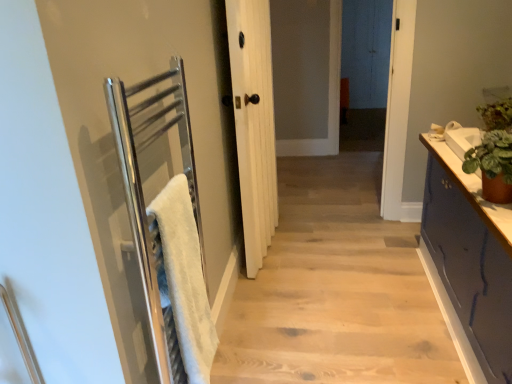
Identify the location of green matte plant pot at right. (473, 192).

What do you see at coordinates (254, 123) in the screenshot? The image size is (512, 384). I see `white wood door at center` at bounding box center [254, 123].

At what (x,y) coordinates should I click in order to perform the action: click on brushed metal towel rail at left. Please return your answer as a coordinate pair (x, y). Looking at the image, I should click on (336, 289).

What's the angular difference between white fluffy bath towel at left and dark blue painted cabinet at right's facing directions?

The angular difference between white fluffy bath towel at left and dark blue painted cabinet at right is 180 degrees.

Between white fluffy bath towel at left and dark blue painted cabinet at right, which one appears on the left side from the viewer's perspective?

From the viewer's perspective, white fluffy bath towel at left appears more on the left side.

Is point (176, 195) closer or farther from the camera than point (433, 250)?

Point (176, 195) is closer to the camera than point (433, 250).

From a real-world perspective, which is physically above, white fluffy bath towel at left or dark blue painted cabinet at right?

white fluffy bath towel at left is physically above.

Does dark blue painted cabinet at right turn towards green leafy plant at right?

No, dark blue painted cabinet at right is not aimed at green leafy plant at right.

Who is smaller, dark blue painted cabinet at right or green leafy plant at right?

green leafy plant at right is smaller.

Considering the sizes of dark blue painted cabinet at right and green leafy plant at right in the image, is dark blue painted cabinet at right wider or thinner than green leafy plant at right?

In the image, dark blue painted cabinet at right appears to be wider than green leafy plant at right.

Consider the image. From the image's perspective, which object appears higher, dark blue painted cabinet at right or green leafy plant at right?

From the image's view, green leafy plant at right is above.

Which is closer, (459, 187) or (242, 182)?

Point (459, 187).

Between green matte plant pot at right and white wood door at center, which one has less height?

green matte plant pot at right is shorter.

Is green matte plant pot at right positioned far away from white wood door at center?

Actually, green matte plant pot at right and white wood door at center are a little close together.

How much distance is there between green leafy plant at right and white fluffy bath towel at left?

green leafy plant at right and white fluffy bath towel at left are 5.29 feet apart from each other.

Is green leafy plant at right not inside white fluffy bath towel at left?

green leafy plant at right is positioned outside white fluffy bath towel at left.

Which of these two, green leafy plant at right or white fluffy bath towel at left, is bigger?

Bigger between the two is white fluffy bath towel at left.

Is the depth of dark blue painted cabinet at right greater than that of green matte plant pot at right?

No, dark blue painted cabinet at right is closer to the camera.

Does point (473, 372) come behind point (499, 223)?

That is True.

Identify the location of cabinetry below the green matte plant pot at right (from a real-world perspective). This screenshot has width=512, height=384. (469, 264).

Is green matte plant pot at right spatially inside white fluffy bath towel at left, or outside of it?

green matte plant pot at right is spatially situated outside white fluffy bath towel at left.

This screenshot has height=384, width=512. Identify the location of bath towel below the green matte plant pot at right (from a real-world perspective). (186, 278).

Is green matte plant pot at right aimed at white fluffy bath towel at left?

No, green matte plant pot at right is not facing towards white fluffy bath towel at left.

From a real-world perspective, is green matte plant pot at right over white fluffy bath towel at left?

Yes, from a real-world perspective, green matte plant pot at right is above white fluffy bath towel at left.

From a real-world perspective, who is located higher, white fluffy bath towel at left or green matte plant pot at right?

green matte plant pot at right is physically above.

Considering the sizes of objects white fluffy bath towel at left and green matte plant pot at right in the image provided, who is smaller, white fluffy bath towel at left or green matte plant pot at right?

white fluffy bath towel at left.

Is green matte plant pot at right completely or partially inside white fluffy bath towel at left?

No, white fluffy bath towel at left does not contain green matte plant pot at right.

Where is `cabinetry in front of the white fluffy bath towel at left`? cabinetry in front of the white fluffy bath towel at left is located at coordinates (469, 264).

You are a GUI agent. You are given a task and a screenshot of the screen. Output one action in this format:
    pyautogui.click(x=<x>, y=<y>)
    Task: Click on the cabinetry below the green leafy plant at right (from a real-world perspective)
    The image size is (512, 384).
    Given the screenshot: What is the action you would take?
    pyautogui.click(x=469, y=264)

Which object lies further to the anchor point green leafy plant at right, brushed metal towel rail at left or white fluffy bath towel at left?

white fluffy bath towel at left is positioned further to the anchor green leafy plant at right.

Which object lies nearer to the anchor point dark blue painted cabinet at right, green matte plant pot at right or brushed metal towel rail at left?

Based on the image, green matte plant pot at right appears to be nearer to dark blue painted cabinet at right.

From the image, which object appears to be nearer to green matte plant pot at right, white fluffy bath towel at left or brushed metal towel rail at left?

brushed metal towel rail at left is positioned closer to the anchor green matte plant pot at right.

Estimate the real-world distances between objects in this image. Which object is closer to brushed metal towel rail at left, dark blue painted cabinet at right or green leafy plant at right?

The object closer to brushed metal towel rail at left is dark blue painted cabinet at right.

Estimate the real-world distances between objects in this image. Which object is closer to green matte plant pot at right, brushed metal towel rail at left or white fluffy bath towel at left?

Based on the image, brushed metal towel rail at left appears to be nearer to green matte plant pot at right.

Looking at the image, which one is located closer to white wood door at center, green matte plant pot at right or brushed metal towel rail at left?

brushed metal towel rail at left is positioned closer to the anchor white wood door at center.

From the image, which object appears to be farther from brushed metal towel rail at left, green leafy plant at right or green matte plant pot at right?

Based on the image, green leafy plant at right appears to be further to brushed metal towel rail at left.

Considering their positions, is dark blue painted cabinet at right positioned closer to green leafy plant at right than brushed metal towel rail at left?

The object closer to green leafy plant at right is dark blue painted cabinet at right.

The image size is (512, 384). I want to click on cabinetry situated between brushed metal towel rail at left and green leafy plant at right from left to right, so click(469, 264).

Image resolution: width=512 pixels, height=384 pixels. I want to click on cabinetry between white wood door at center and green leafy plant at right from left to right, so click(469, 264).

Find the location of a particular element. The height and width of the screenshot is (384, 512). door between brushed metal towel rail at left and dark blue painted cabinet at right in the horizontal direction is located at coordinates (254, 123).

Identify the location of door situated between brushed metal towel rail at left and green leafy plant at right from left to right. (254, 123).